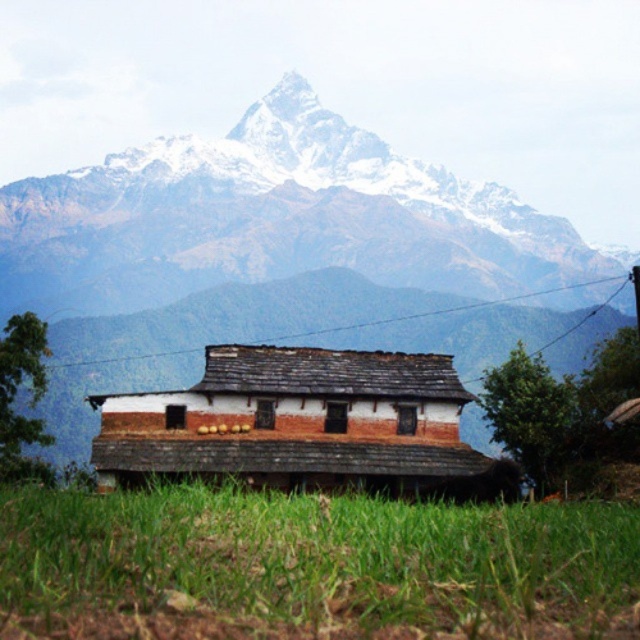
Question: Which object is closer to the camera taking this photo?

Choices:
 (A) green grass at lower center
 (B) snowy granite mountain range at upper center
 (C) white brick hut at center

Answer: (A)

Question: Observing the image, what is the correct spatial positioning of snowy granite mountain range at upper center in reference to green grass at lower center?

Choices:
 (A) right
 (B) left

Answer: (B)

Question: Observing the image, what is the correct spatial positioning of green grass at lower center in reference to white brick hut at center?

Choices:
 (A) below
 (B) above

Answer: (A)

Question: Which of the following is the closest to the observer?

Choices:
 (A) white brick hut at center
 (B) snowy granite mountain range at upper center
 (C) green grass at lower center

Answer: (C)

Question: Considering the real-world distances, which object is closest to the green grass at lower center?

Choices:
 (A) snowy granite mountain range at upper center
 (B) white brick hut at center

Answer: (B)

Question: Is snowy granite mountain range at upper center below white brick hut at center?

Choices:
 (A) no
 (B) yes

Answer: (A)